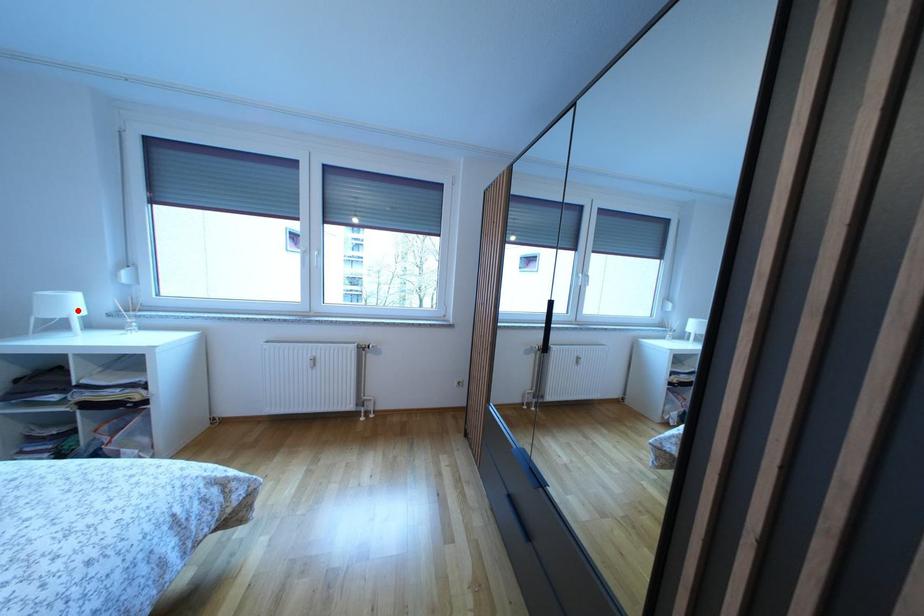
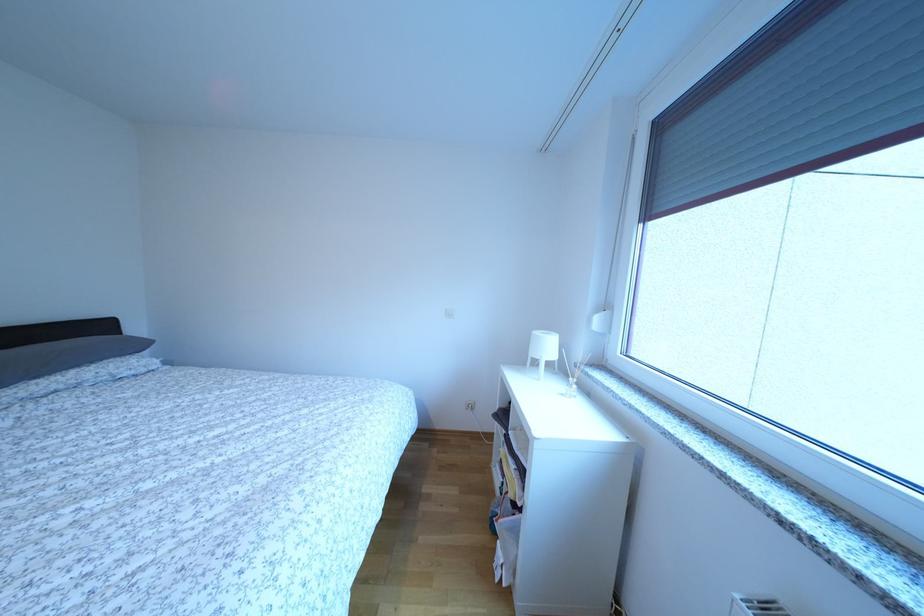
In the second image, find the point that corresponds to the highlighted location in the first image.

(554, 353)